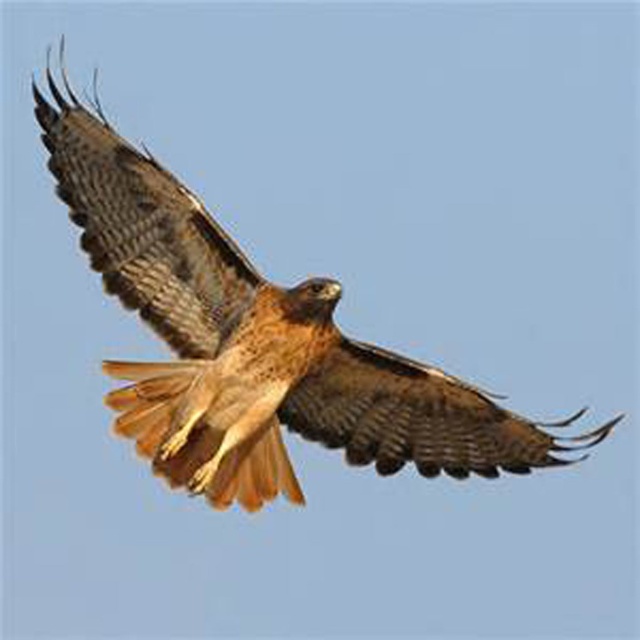
You are a wildlife photographer trying to capture the brown feathered eagle at center and the brown textured wing at upper left in a single shot. Which object should you focus on first to ensure both are in frame?

The brown feathered eagle at center is taller than the brown textured wing at upper left, so you should focus on the brown feathered eagle at center first to ensure both are in frame.

You are a wildlife photographer trying to capture a hawk in flight. You notice the brown textured wing at upper left and the brown feathered wing at center. Which wing is located to the left of the other?

The brown textured wing at upper left is positioned on the left side of brown feathered wing at center.

You are a wildlife photographer observing a hawk in flight. You notice the brown textured wing at upper left and the brown feathered wing at center. Which wing is positioned higher in the sky?

The brown textured wing at upper left is positioned higher in the sky than the brown feathered wing at center because it is located above it.